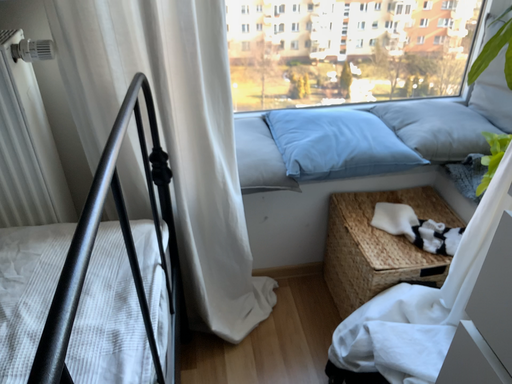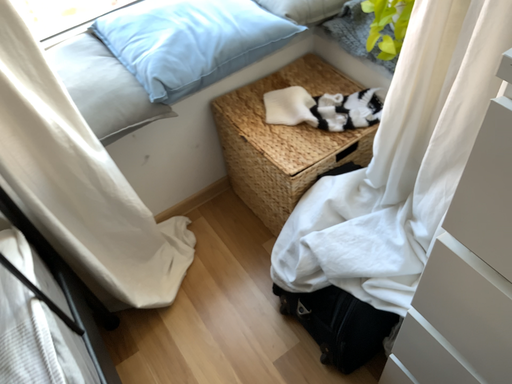
Question: Which way did the camera rotate in the video?

Choices:
 (A) rotated left
 (B) rotated right

Answer: (B)